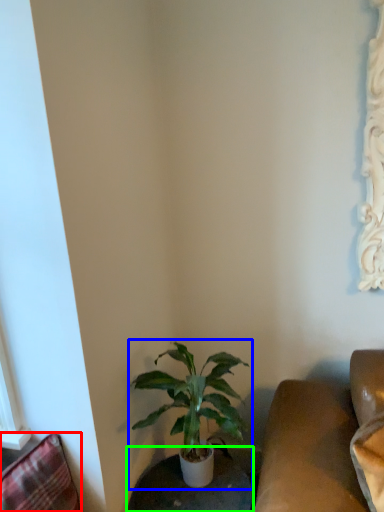
Question: Estimate the real-world distances between objects in this image. Which object is closer to swivel chair (highlighted by a red box), houseplant (highlighted by a blue box) or round table (highlighted by a green box)?

Choices:
 (A) houseplant
 (B) round table

Answer: (A)